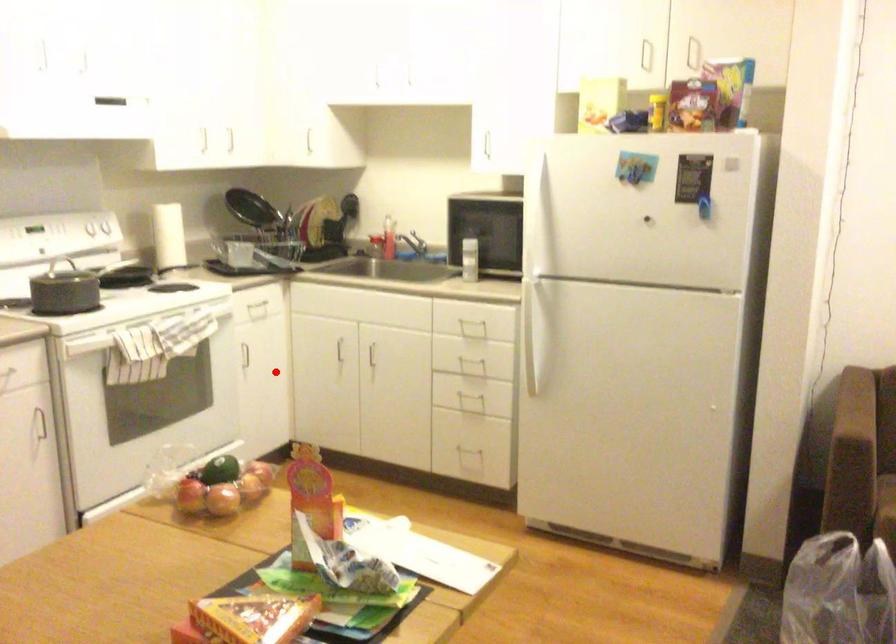
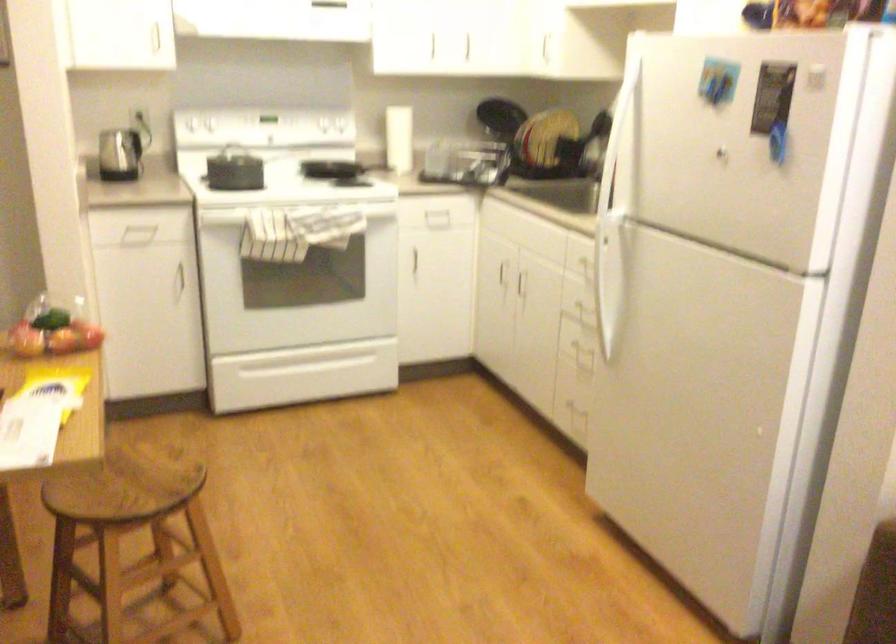
The point at the highlighted location is marked in the first image. Where is the corresponding point in the second image?

(435, 276)